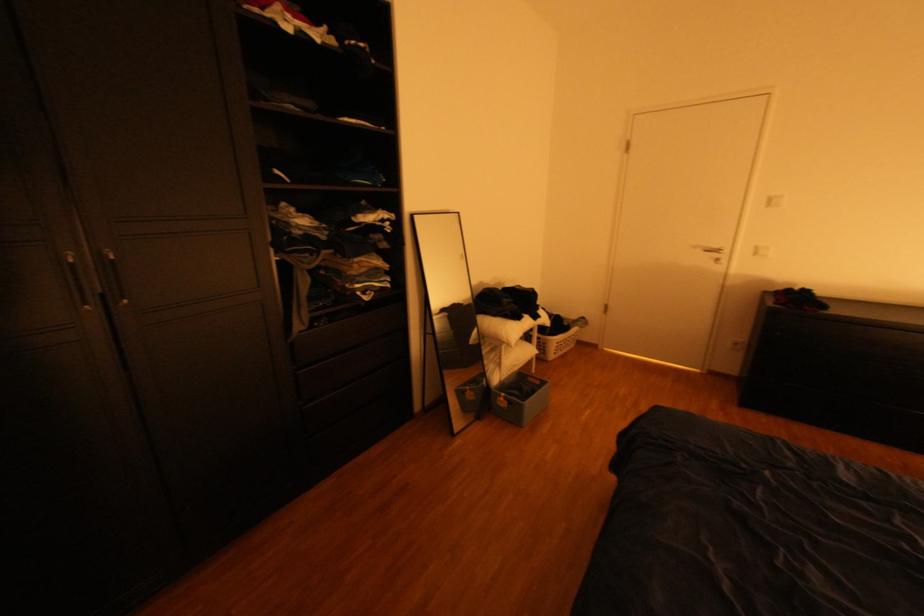
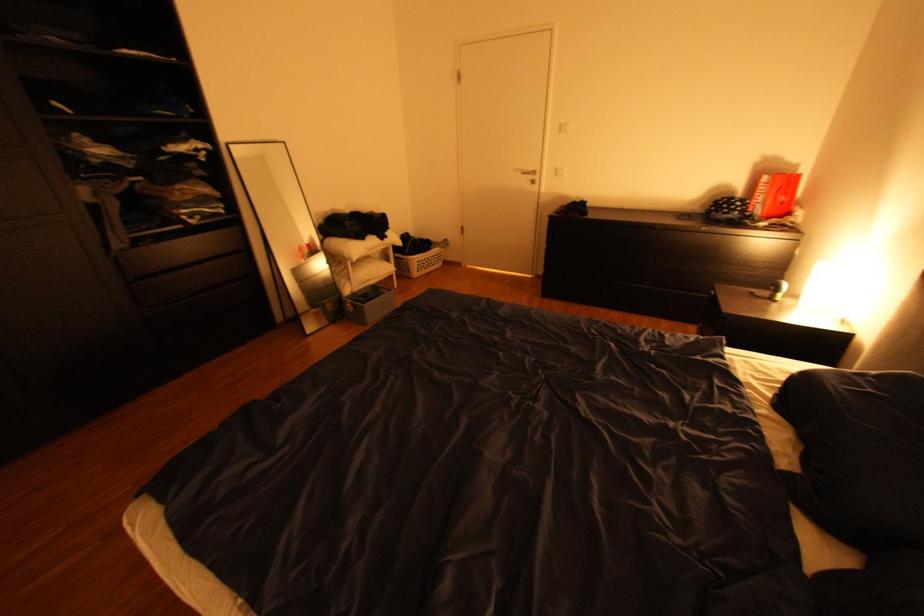
Find the pixel in the second image that matches point (763, 254) in the first image.

(565, 174)